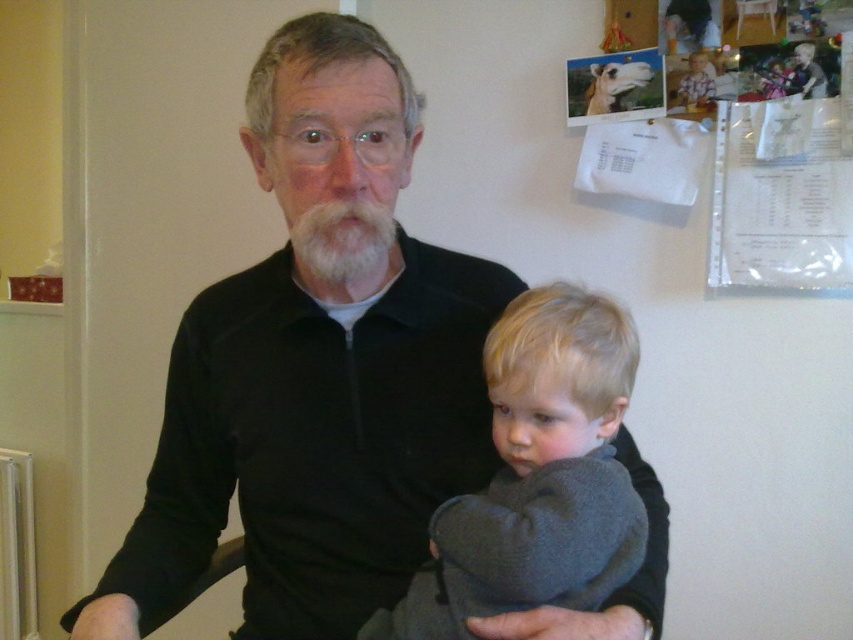
You are standing in the room and want to reach the point marked at coordinates (467,339). If your height is 60 inches, will you need to bend down to reach it?

The point at coordinates (467,339) is 38.66 inches away from the viewer. Since the viewer is 60 inches tall, they will need to bend down to reach it because the point is below their eye level.

You are standing in the room and want to touch both points. Which point should you reach for first, point (561, 604) or point (366, 272)?

You should reach for point (561, 604) first because it is closer to you than point (366, 272).

You are a painter standing between the black smooth arm at center and the white fuzzy beard at center. Which object is closer to you?

The black smooth arm at center is closer to you because it is further to the viewer than the white fuzzy beard at center.